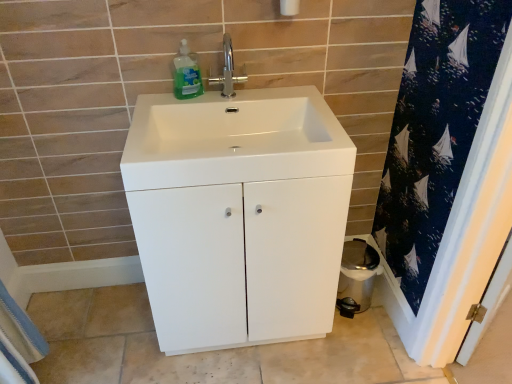
Image resolution: width=512 pixels, height=384 pixels. I want to click on vacant area to the right of polished chrome faucet at center, so click(276, 103).